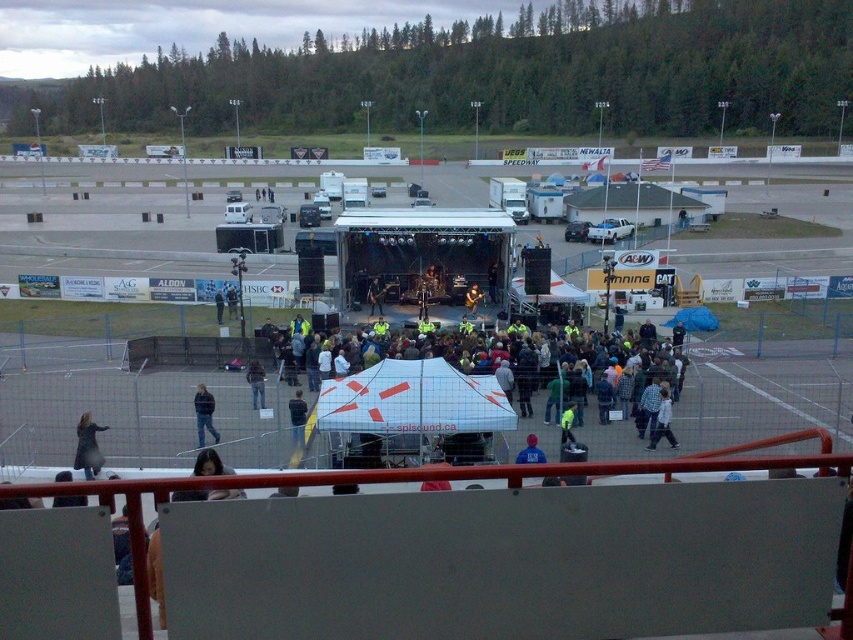
Can you confirm if white cotton jacket at lower center is bigger than dark blue jacket at center?

No.

I want to click on white cotton jacket at lower center, so click(x=663, y=420).

Is point (202, 424) closer to camera compared to point (260, 368)?

Yes.

Based on the photo, can you confirm if blue denim jeans at lower left is positioned to the right of dark blue jeans at center?

Incorrect, blue denim jeans at lower left is not on the right side of dark blue jeans at center.

Between point (202, 387) and point (254, 388), which one is positioned in front?

Point (202, 387) is more forward.

Image resolution: width=853 pixels, height=640 pixels. In order to click on blue denim jeans at lower left in this screenshot , I will do `click(204, 413)`.

Which is more to the right, blue denim jeans at lower left or blue fabric at center?

blue fabric at center is more to the right.

Is blue denim jeans at lower left smaller than blue fabric at center?

Correct, blue denim jeans at lower left occupies less space than blue fabric at center.

Who is more forward, (200, 442) or (535, 448)?

Point (535, 448)

You are a GUI agent. You are given a task and a screenshot of the screen. Output one action in this format:
    pyautogui.click(x=<x>, y=<y>)
    Task: Click on the blue denim jeans at lower left
    The width and height of the screenshot is (853, 640).
    Given the screenshot: What is the action you would take?
    pyautogui.click(x=204, y=413)